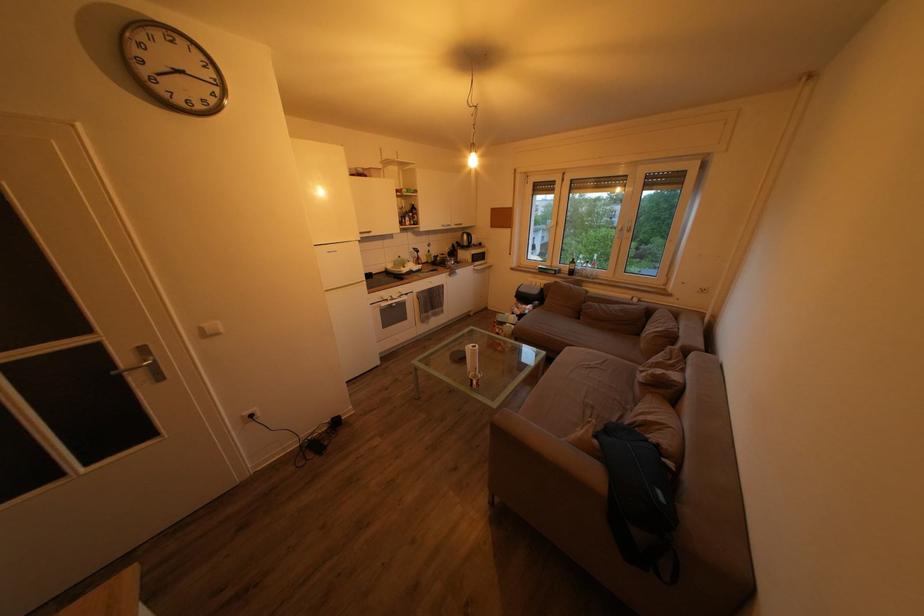
The width and height of the screenshot is (924, 616). What do you see at coordinates (210, 329) in the screenshot?
I see `the white light switch` at bounding box center [210, 329].